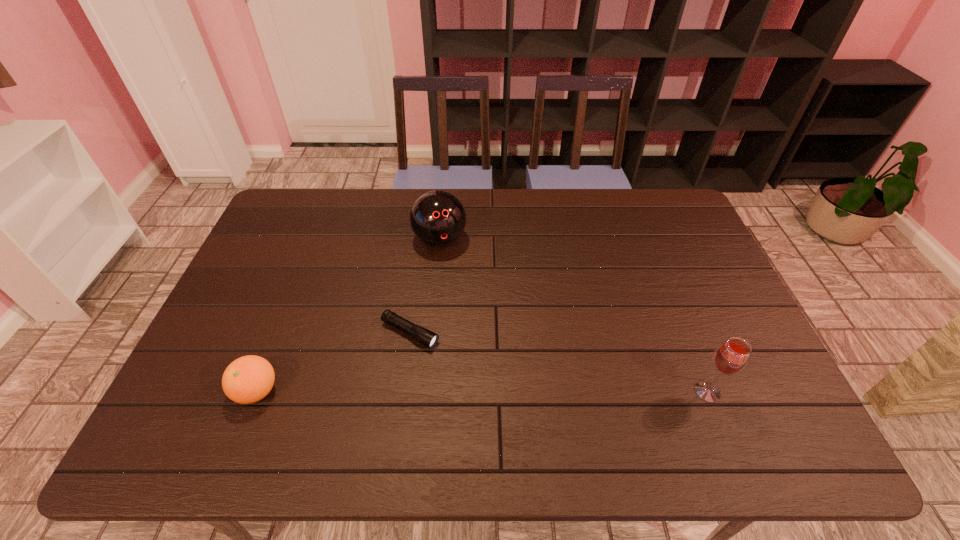
Find the location of `the second shortest object`. the second shortest object is located at coordinates (248, 379).

Identify the location of the leftmost object. The height and width of the screenshot is (540, 960). (248, 379).

The image size is (960, 540). What are the coordinates of `wineglass` in the screenshot? It's located at (731, 357).

Where is `the farthest object`? The height and width of the screenshot is (540, 960). the farthest object is located at coordinates (437, 218).

I want to click on the second farthest object, so click(x=424, y=336).

This screenshot has height=540, width=960. What are the coordinates of `flashlight` in the screenshot? It's located at (424, 336).

Where is `blank area located on the back of the second shortest object`? Image resolution: width=960 pixels, height=540 pixels. blank area located on the back of the second shortest object is located at coordinates (293, 300).

The height and width of the screenshot is (540, 960). What are the coordinates of `vacant region located 0.100m on the right of the rightmost object` in the screenshot? It's located at (763, 392).

The width and height of the screenshot is (960, 540). Identify the location of blank space located on the surface of the farthest object near the finger holes. (460, 301).

Identify the location of vacant space located 0.130m on the surface of the farthest object near the finger holes. This screenshot has width=960, height=540. (455, 287).